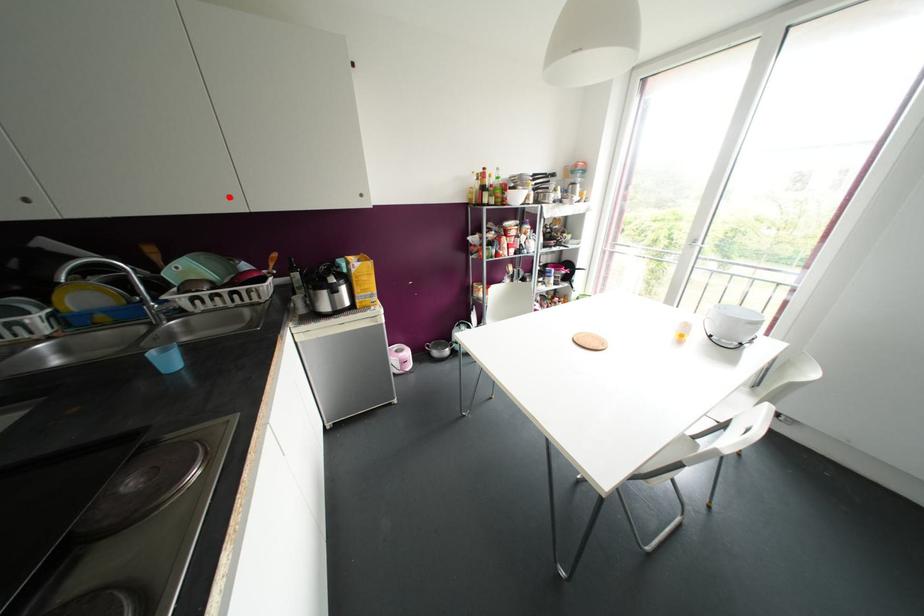
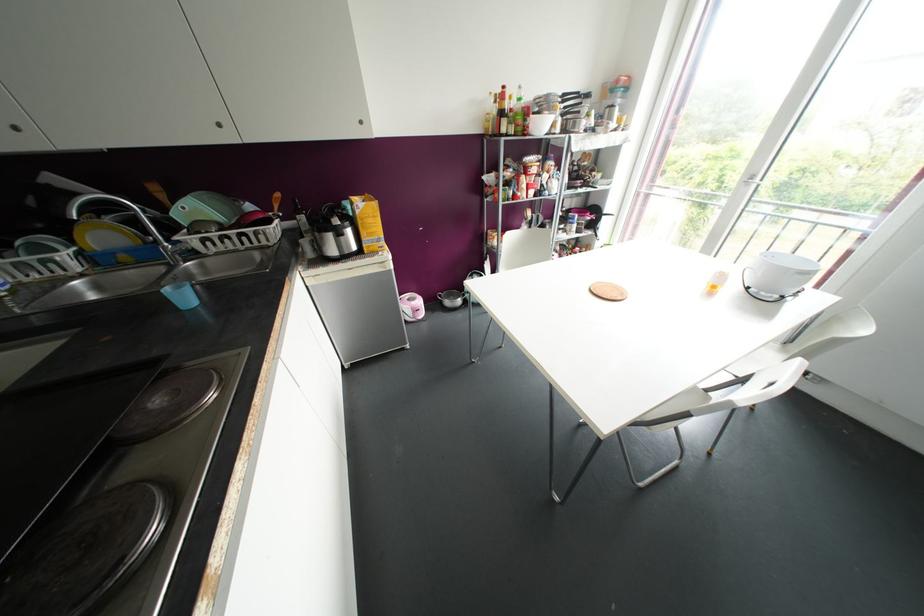
Locate, in the second image, the point that corresponds to the highlighted location in the first image.

(219, 124)